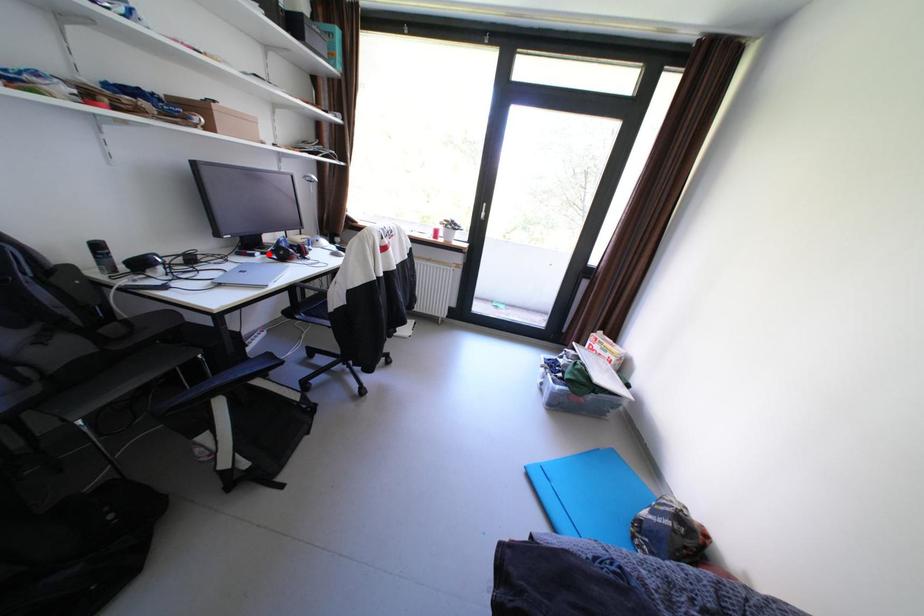
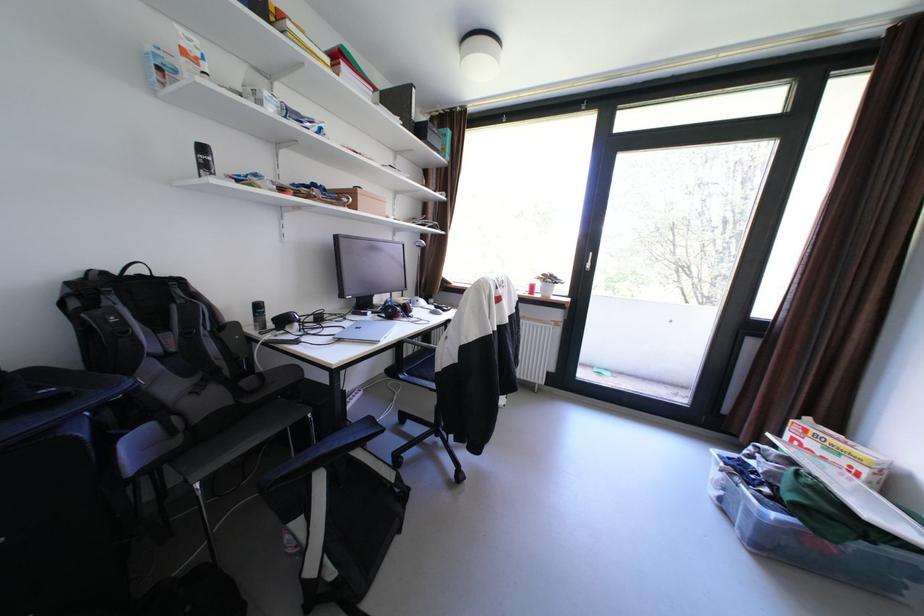
Locate, in the second image, the point that corresponds to the highlighted location in the first image.

(380, 313)